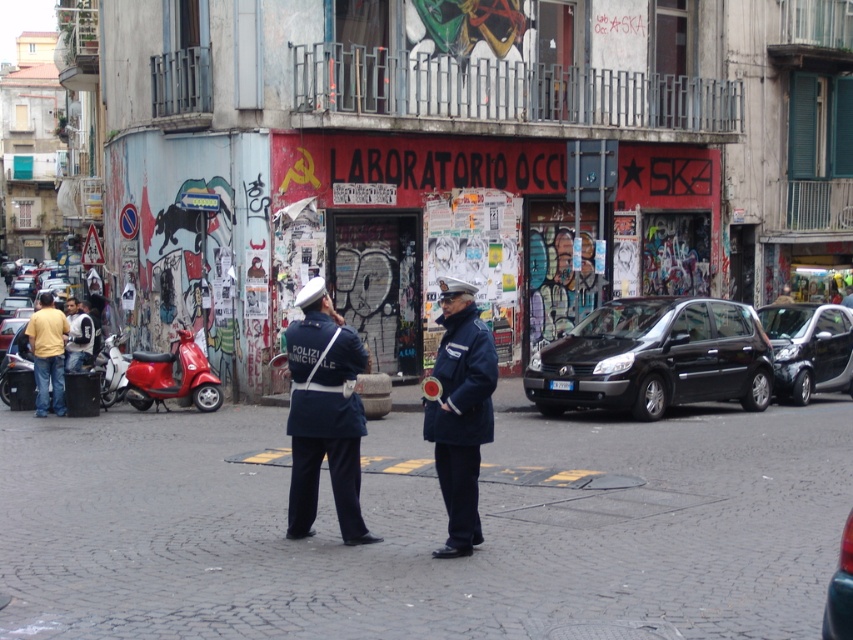
Question: Can you confirm if navy blue fabric uniform at center is positioned to the left of light brown leather jacket at center?

Choices:
 (A) yes
 (B) no

Answer: (A)

Question: Can you confirm if black matte car at center is bigger than metallic blue car at lower right?

Choices:
 (A) no
 (B) yes

Answer: (B)

Question: Estimate the real-world distances between objects in this image. Which object is farther from the yellow cotton shirt at left?

Choices:
 (A) shiny red scooter at left
 (B) light blue denim jacket at left
 (C) black matte car at center
 (D) navy blue fabric uniform at center

Answer: (D)

Question: Which object appears closest to the camera in this image?

Choices:
 (A) dark blue fabric jacket at center
 (B) shiny black car at right
 (C) shiny red scooter at left
 (D) metallic blue car at lower right

Answer: (D)

Question: Is shiny black car at right closer to the viewer compared to light brown leather jacket at center?

Choices:
 (A) no
 (B) yes

Answer: (B)

Question: Which is nearer to the shiny red scooter at left?

Choices:
 (A) dark blue fabric jacket at center
 (B) black matte car at center

Answer: (B)